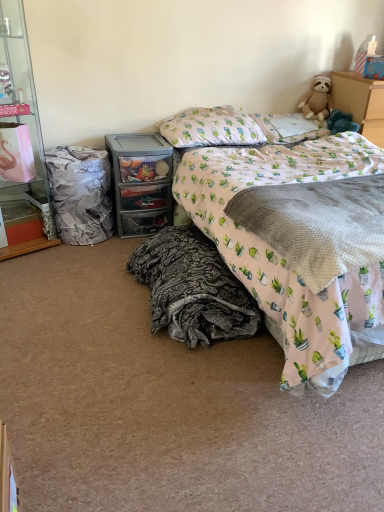
Question: From the image's perspective, is fluffy beige teddy bear at upper right beneath pillow at upper center, which is counted as the second pillow, starting from the right?

Choices:
 (A) yes
 (B) no

Answer: (B)

Question: Could pillow at upper center, which is counted as the second pillow, starting from the right, be considered to be inside fluffy beige teddy bear at upper right?

Choices:
 (A) yes
 (B) no

Answer: (B)

Question: Does fluffy beige teddy bear at upper right have a lesser height compared to pillow at upper center, which is counted as the second pillow, starting from the right?

Choices:
 (A) no
 (B) yes

Answer: (A)

Question: Can you confirm if fluffy beige teddy bear at upper right is smaller than pillow at upper center, arranged as the 1th pillow when viewed from the left?

Choices:
 (A) no
 (B) yes

Answer: (B)

Question: Does fluffy beige teddy bear at upper right appear on the right side of pillow at upper center, arranged as the 1th pillow when viewed from the left?

Choices:
 (A) no
 (B) yes

Answer: (B)

Question: Is the depth of fluffy beige teddy bear at upper right greater than that of pillow at upper center, which is counted as the second pillow, starting from the right?

Choices:
 (A) yes
 (B) no

Answer: (A)

Question: From the image's perspective, would you say gray textured blanket at center, which ranks as the 2th blanket in left-to-right order, is shown under pink fabric bed at center?

Choices:
 (A) no
 (B) yes

Answer: (B)

Question: From the image's perspective, does gray textured blanket at center, which ranks as the 2th blanket in left-to-right order, appear higher than pink fabric bed at center?

Choices:
 (A) yes
 (B) no

Answer: (B)

Question: Can you confirm if gray textured blanket at center, which ranks as the 2th blanket in left-to-right order, is thinner than pink fabric bed at center?

Choices:
 (A) yes
 (B) no

Answer: (A)

Question: Does gray textured blanket at center, which is the first blanket in right-to-left order, have a greater height compared to pink fabric bed at center?

Choices:
 (A) no
 (B) yes

Answer: (A)

Question: Is the depth of gray textured blanket at center, which is the first blanket in right-to-left order, greater than that of pink fabric bed at center?

Choices:
 (A) yes
 (B) no

Answer: (A)

Question: From a real-world perspective, is gray textured blanket at center, which is the first blanket in right-to-left order, over pink fabric bed at center?

Choices:
 (A) yes
 (B) no

Answer: (A)

Question: Is the position of pink fabric bed at center less distant than that of cactus-patterned fabric pillow at upper right, the 2th pillow viewed from the left?

Choices:
 (A) yes
 (B) no

Answer: (A)